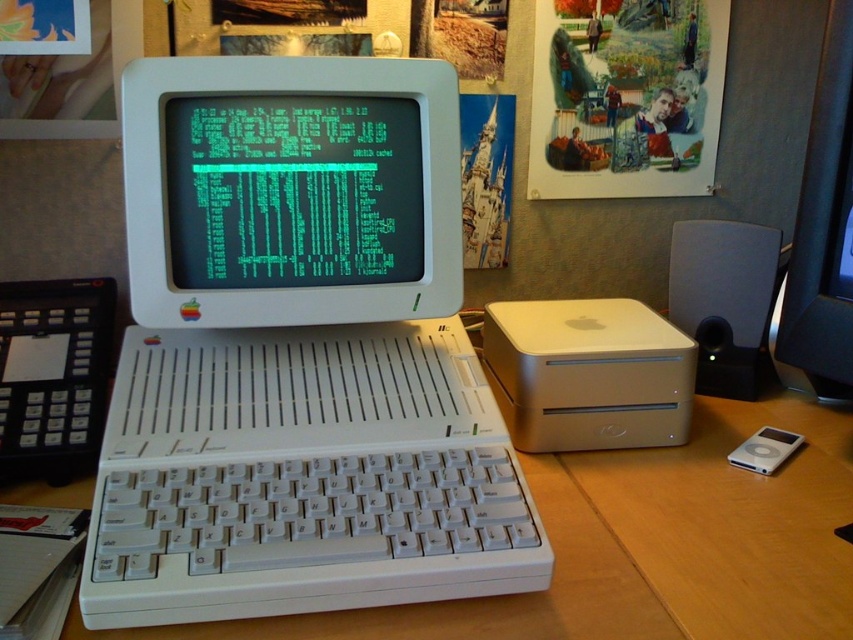
Question: Is white plastic monitor at center wider than wooden table at center?

Choices:
 (A) yes
 (B) no

Answer: (B)

Question: Is white plastic computer at center closer to camera compared to matte black speaker at right?

Choices:
 (A) no
 (B) yes

Answer: (B)

Question: Which point is farther to the camera?

Choices:
 (A) matte black speaker at right
 (B) wooden table at center
 (C) white plastic monitor at center
 (D) white plastic computer at center

Answer: (A)

Question: Which of the following is the farthest from the observer?

Choices:
 (A) (735, 310)
 (B) (173, 225)

Answer: (A)

Question: Which point is farther to the camera?

Choices:
 (A) (749, 278)
 (B) (390, 104)
 (C) (560, 529)
 (D) (398, 124)

Answer: (A)

Question: Where is white plastic monitor at center located in relation to matte black speaker at right in the image?

Choices:
 (A) right
 (B) left

Answer: (B)